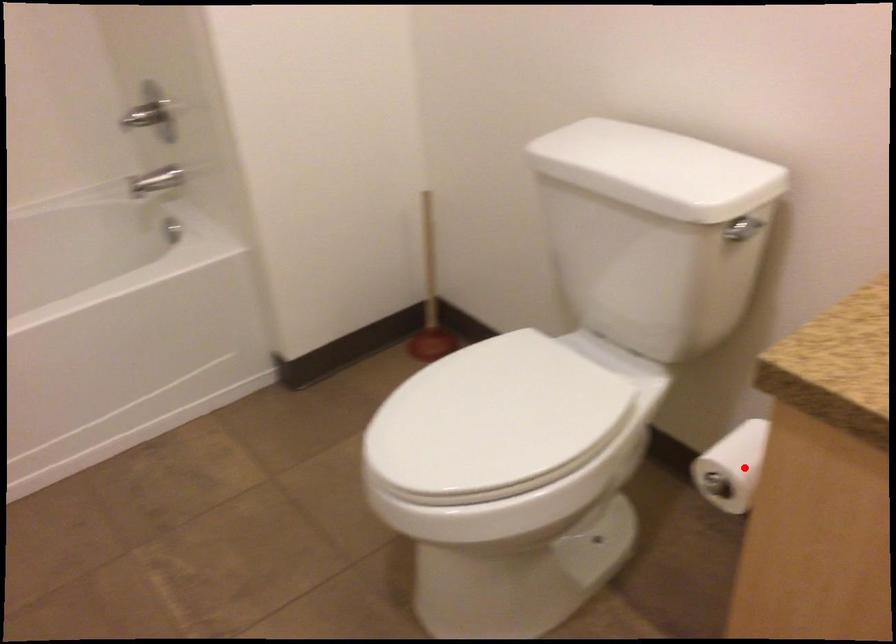
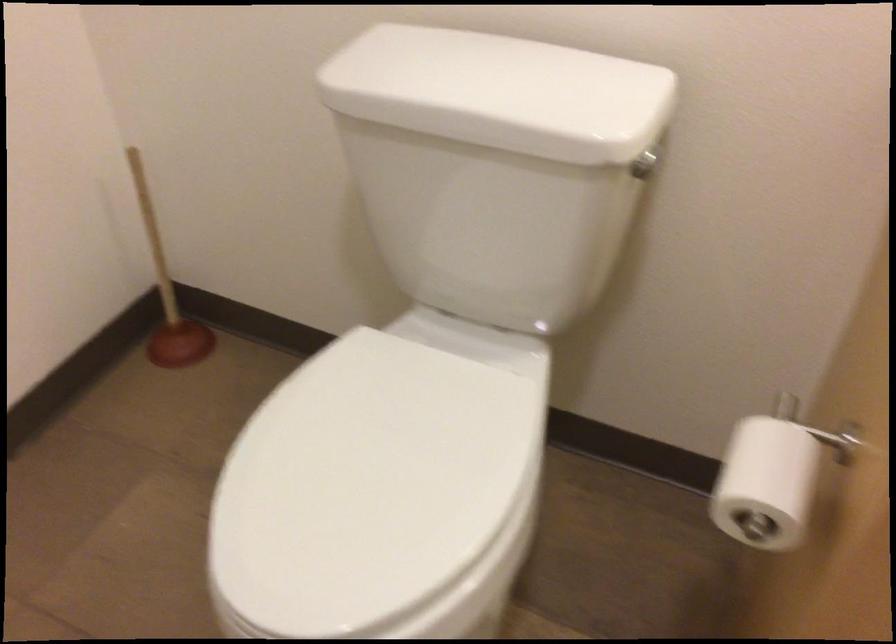
The point at the highlighted location is marked in the first image. Where is the corresponding point in the second image?

(765, 484)